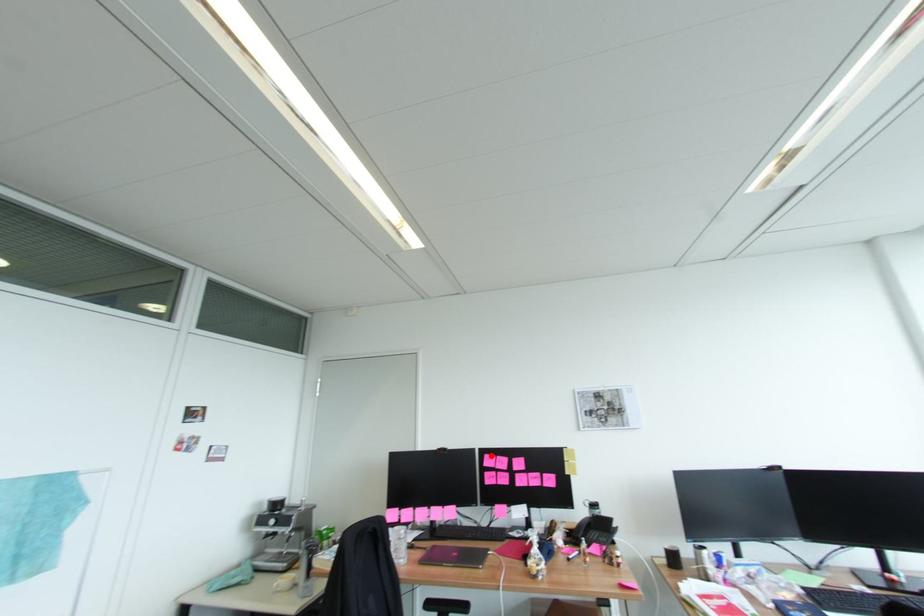
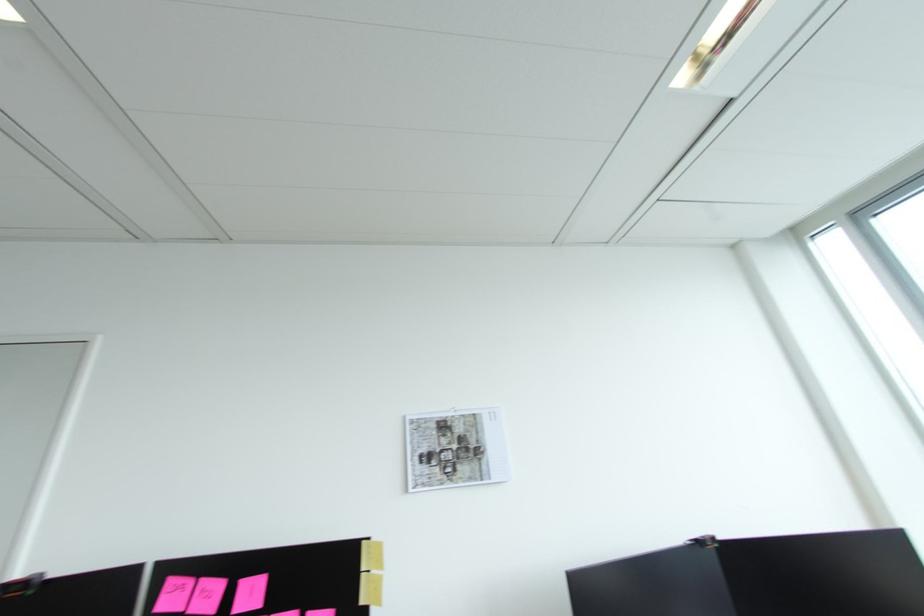
Where in the second image is the point corresponding to the highlighted location from the first image?

(176, 582)